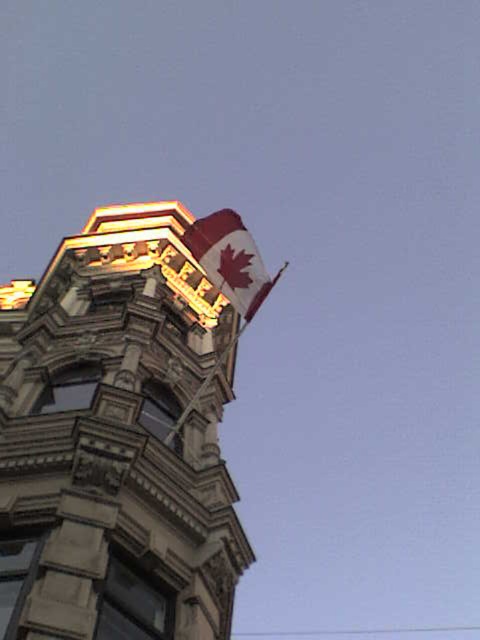
Question: Considering the relative positions of polished stone tower at upper center and red and white fabric flag at upper center in the image provided, where is polished stone tower at upper center located with respect to red and white fabric flag at upper center?

Choices:
 (A) left
 (B) right

Answer: (A)

Question: Among these points, which one is farthest from the camera?

Choices:
 (A) (52, 548)
 (B) (242, 237)

Answer: (B)

Question: Is red and white fabric flag at upper center to the right of metallic flag pole at upper center from the viewer's perspective?

Choices:
 (A) yes
 (B) no

Answer: (B)

Question: Among these points, which one is farthest from the camera?

Choices:
 (A) (183, 419)
 (B) (231, 282)
 (C) (165, 452)

Answer: (B)

Question: Is polished stone tower at upper center smaller than metallic flag pole at upper center?

Choices:
 (A) no
 (B) yes

Answer: (B)

Question: Which object is closer to the camera taking this photo?

Choices:
 (A) red and white fabric flag at upper center
 (B) polished stone tower at upper center

Answer: (B)